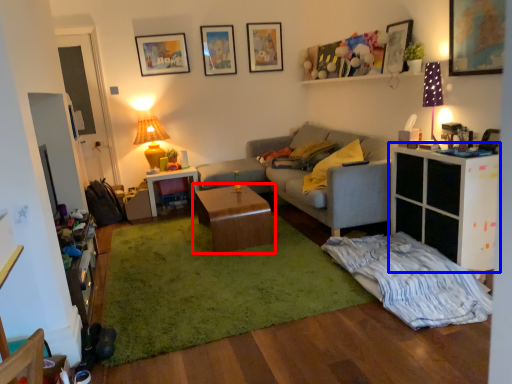
Question: Which object appears farthest to the camera in this image, table (highlighted by a red box) or cabinetry (highlighted by a blue box)?

Choices:
 (A) table
 (B) cabinetry

Answer: (A)